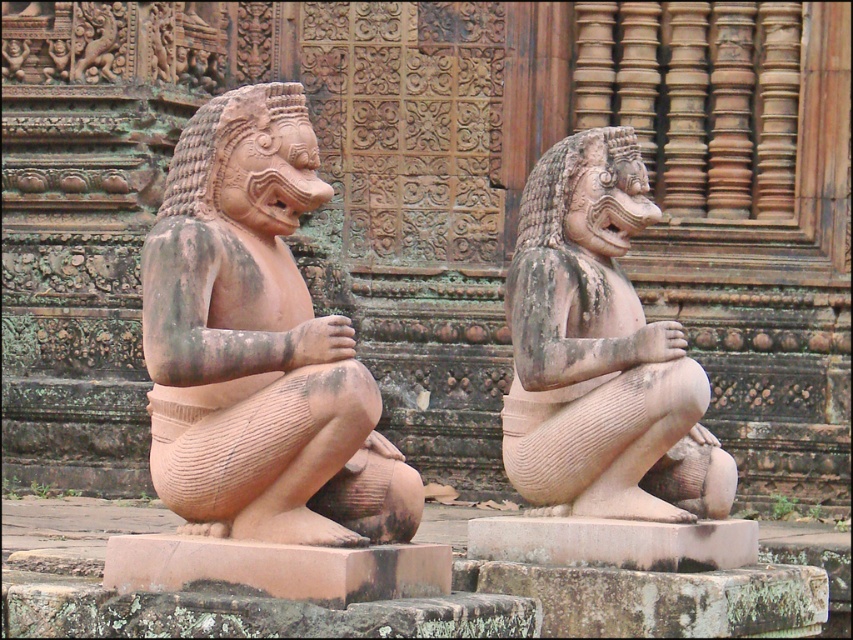
You are an art conservator assessing the statues in the temple. You need to determine which statue requires more space for storage. Which statue between the earthy stone statue at left and the matte stone statue at center requires more storage space?

The matte stone statue at center requires more storage space because it is larger than the earthy stone statue at left.

You are an archaeologist examining two statues in front of a temple. You notice the earthy stone statue at left and the matte stone statue at center. Which statue is taller?

The matte stone statue at center is taller than the earthy stone statue at left.

You are standing in front of the temple and see two earthy stone statues. Which one is positioned at the coordinates point (x=258, y=346)?

The earthy stone statue at left is positioned at point (x=258, y=346).